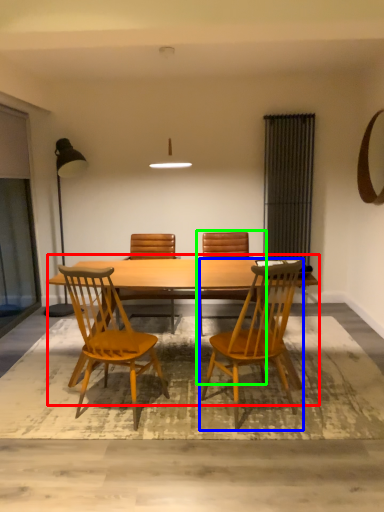
Question: Based on their relative distances, which object is nearer to kitchen & dining room table (highlighted by a red box)? Choose from chair (highlighted by a blue box) and chair (highlighted by a green box).

Choices:
 (A) chair
 (B) chair

Answer: (A)